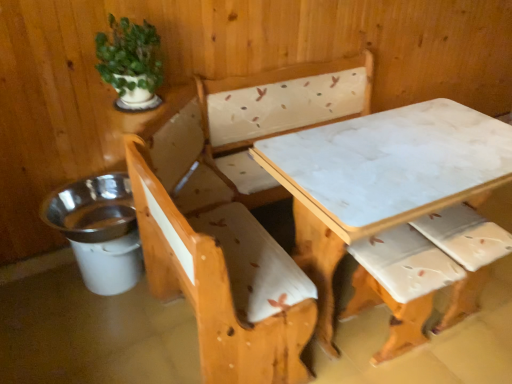
Image resolution: width=512 pixels, height=384 pixels. What do you see at coordinates (394, 190) in the screenshot?
I see `white marble table at center` at bounding box center [394, 190].

In order to face white marble table at center, should I rotate leftwards or rightwards?

Turn right approximately 17.664 degrees to face it.

At what (x,y) coordinates should I click in order to perform the action: click on white marble table at center. Please return your answer as a coordinate pair (x, y). This screenshot has height=384, width=512. Looking at the image, I should click on (394, 190).

This screenshot has height=384, width=512. Describe the element at coordinates (130, 63) in the screenshot. I see `green matte plant at upper left` at that location.

This screenshot has height=384, width=512. What are the coordinates of `green matte plant at upper left` in the screenshot? It's located at (130, 63).

I want to click on white marble table at center, so click(394, 190).

Is green matte plant at upper left at the right side of white marble table at center?

No, green matte plant at upper left is not to the right of white marble table at center.

Between green matte plant at upper left and white marble table at center, which one is positioned behind?

green matte plant at upper left.

Which point is more distant from viewer, [154,58] or [465,242]?

The point [154,58] is farther from the camera.

From the image's perspective, is green matte plant at upper left on top of white marble table at center?

Yes.

From a real-world perspective, which is physically above, green matte plant at upper left or white marble table at center?

green matte plant at upper left.

Can you confirm if green matte plant at upper left is wider than white marble table at center?

No.

Between green matte plant at upper left and white marble table at center, which one has more height?

white marble table at center is taller.

Considering the relative sizes of green matte plant at upper left and white marble table at center in the image provided, is green matte plant at upper left smaller than white marble table at center?

Correct, green matte plant at upper left occupies less space than white marble table at center.

Can white marble table at center be found inside green matte plant at upper left?

No, white marble table at center is not surrounded by green matte plant at upper left.

Is green matte plant at upper left far from white marble table at center?

Actually, green matte plant at upper left and white marble table at center are a little close together.

Is green matte plant at upper left turned away from white marble table at center?

green matte plant at upper left is not turned away from white marble table at center.

Can you tell me how much green matte plant at upper left and white marble table at center differ in facing direction?

The angle between the facing direction of green matte plant at upper left and the facing direction of white marble table at center is 1.17 degrees.

The image size is (512, 384). Identify the location of houseplant on the left of the white marble table at center. (130, 63).

Is white marble table at center to the left or to the right of green matte plant at upper left in the image?

Clearly, white marble table at center is on the right of green matte plant at upper left in the image.

Which object is closer to the camera taking this photo, white marble table at center or green matte plant at upper left?

white marble table at center.

Is point (366, 267) more distant than point (144, 30)?

No.

From the image's perspective, relative to green matte plant at upper left, is white marble table at center above or below?

white marble table at center is situated lower than green matte plant at upper left in the image.

From a real-world perspective, is white marble table at center on green matte plant at upper left?

No, from a real-world perspective, white marble table at center is not above green matte plant at upper left.

In terms of width, does white marble table at center look wider or thinner when compared to green matte plant at upper left?

Considering their sizes, white marble table at center looks broader than green matte plant at upper left.

In the scene shown: Considering the relative sizes of white marble table at center and green matte plant at upper left in the image provided, is white marble table at center shorter than green matte plant at upper left?

No, white marble table at center is not shorter than green matte plant at upper left.

Who is bigger, white marble table at center or green matte plant at upper left?

white marble table at center is bigger.

Which is correct: white marble table at center is inside green matte plant at upper left, or outside of it?

white marble table at center is not enclosed by green matte plant at upper left.

Would you consider white marble table at center to be distant from green matte plant at upper left?

No, white marble table at center is in close proximity to green matte plant at upper left.

Is white marble table at center facing towards green matte plant at upper left?

No, white marble table at center is not aimed at green matte plant at upper left.

How many degrees apart are the facing directions of white marble table at center and green matte plant at upper left?

The angle between the facing direction of white marble table at center and the facing direction of green matte plant at upper left is 1.17 degrees.

At what (x,y) coordinates should I click in order to perform the action: click on houseplant behind the white marble table at center. Please return your answer as a coordinate pair (x, y). Looking at the image, I should click on (130, 63).

Locate an element on the screen. table on the right of green matte plant at upper left is located at coordinates (394, 190).

Where is `houseplant that appears on the left of white marble table at center`? The width and height of the screenshot is (512, 384). houseplant that appears on the left of white marble table at center is located at coordinates (130, 63).